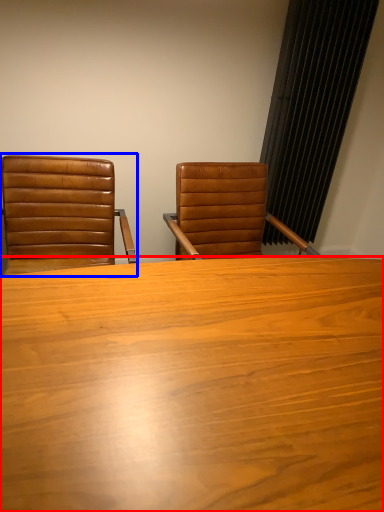
Question: Which of the following is the closest to the observer, table (highlighted by a red box) or chair (highlighted by a blue box)?

Choices:
 (A) table
 (B) chair

Answer: (A)